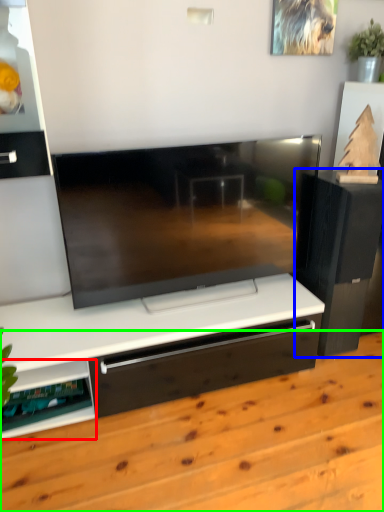
Question: Which object is the closest to the shelf (highlighted by a red box)? Choose among these: furniture (highlighted by a blue box) or hardwood (highlighted by a green box).

Choices:
 (A) furniture
 (B) hardwood

Answer: (B)